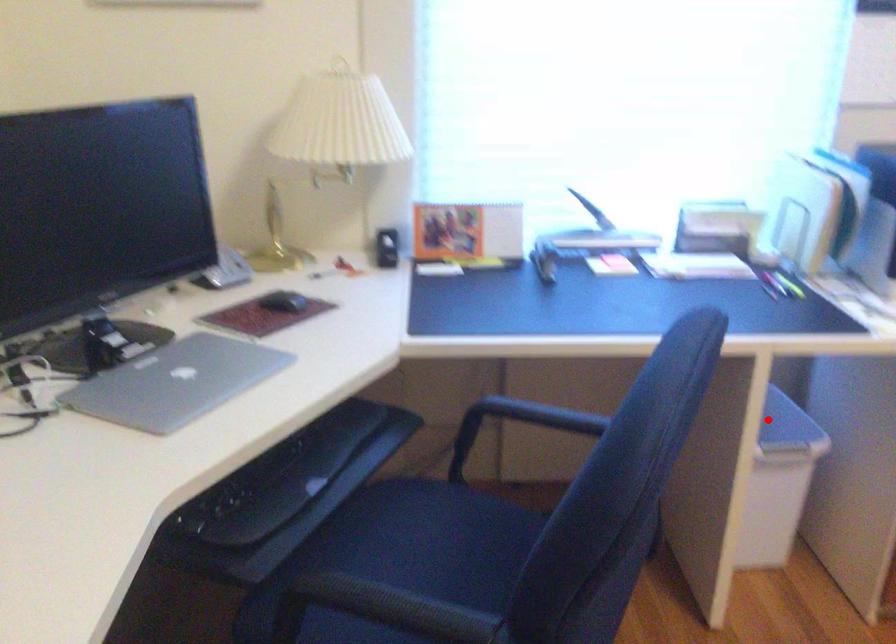
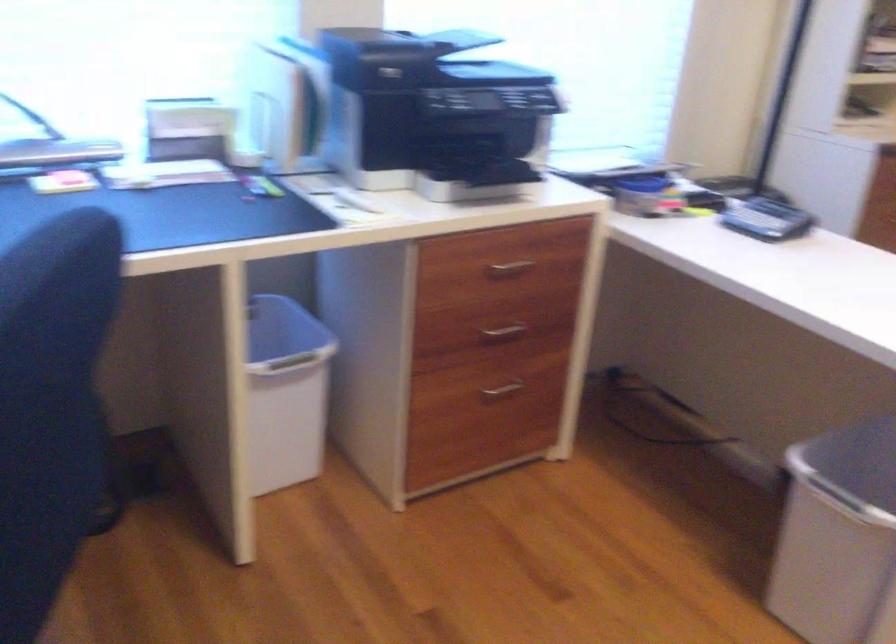
Where in the second image is the point corresponding to the highlighted location from the first image?

(281, 328)